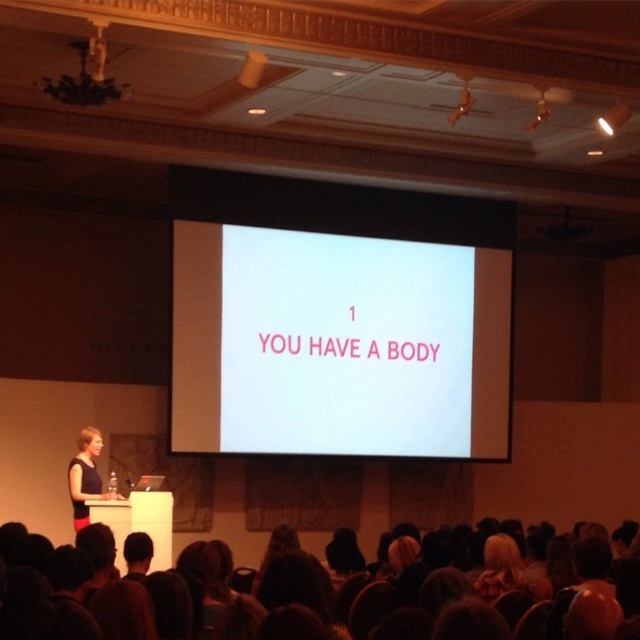
Question: Which of the following is the closest to the observer?

Choices:
 (A) (209, 394)
 (B) (90, 568)
 (C) (524, 564)

Answer: (B)

Question: Does dark hair at lower center appear over blonde hair at lower center?

Choices:
 (A) yes
 (B) no

Answer: (A)

Question: Can you confirm if dark hair at lower center is positioned below blonde hair at lower center?

Choices:
 (A) yes
 (B) no

Answer: (B)

Question: Which of the following is the farthest from the observer?

Choices:
 (A) dark hair at lower center
 (B) white matte projection screen at center

Answer: (B)

Question: Which of the following is the closest to the observer?

Choices:
 (A) dark hair at lower center
 (B) blonde hair at lower center
 (C) white matte projection screen at center

Answer: (A)

Question: Where is white matte projection screen at center located in relation to dark hair at lower center in the image?

Choices:
 (A) above
 (B) below

Answer: (A)